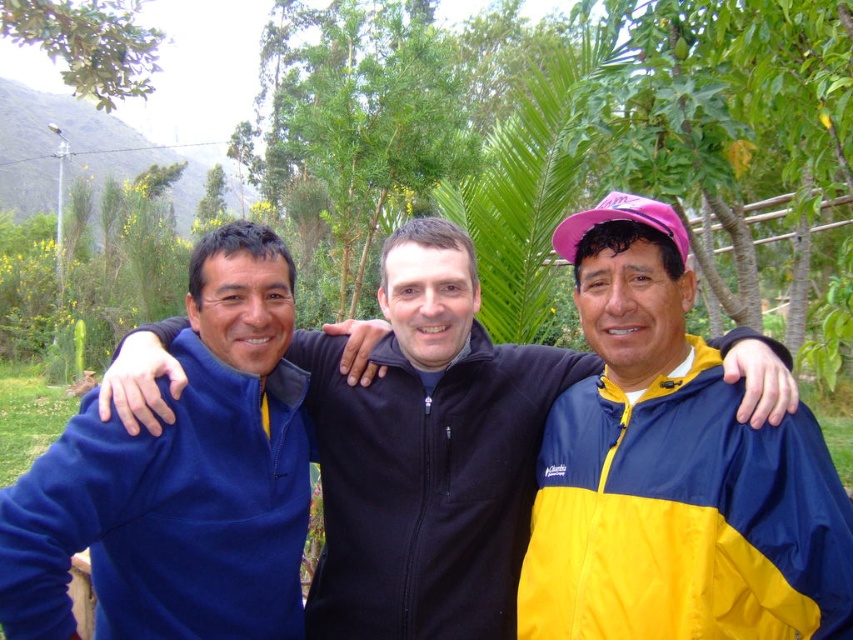
You are a photographer trying to capture a group photo of the blue fleece jacket at center and the blue fleece jacket at left. Since you want to ensure both jackets are clearly visible in the photo, which jacket should you position closer to the camera to avoid being blocked by the other?

The blue fleece jacket at center is much taller than the blue fleece jacket at left, so you should position the shorter blue fleece jacket at left closer to the camera to prevent it from being blocked by the taller blue fleece jacket at center.

You are standing in the park and see three people. The person on the left is wearing a dark blue zip up jacket, the middle person is in a black zip up jacket, and the person on the right is wearing a red sweater. A point at coordinates (426, 452) is mentioned. Which jacket does this point belong to?

The point at (426, 452) is on the blue fleece jacket at center.

You are a photographer wanting to capture a group photo of the blue fleece jacket at center and yellowshiny fabricjacket at right. The camera you have can only focus on objects within 20 inches of each other. Can you take a clear photo of both jackets without moving them?

The distance between the blue fleece jacket at center and yellowshiny fabricjacket at right is 21.23 inches. Since the camera requires objects to be within 20 inches for clear focus, the jackets are slightly too far apart. Moving them closer by about 1.23 inches would allow both to be in focus.